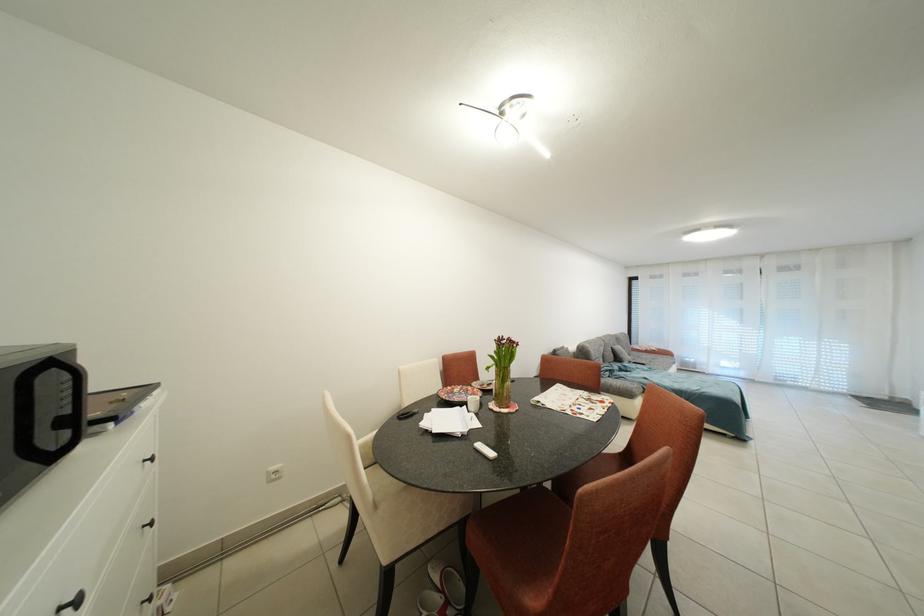
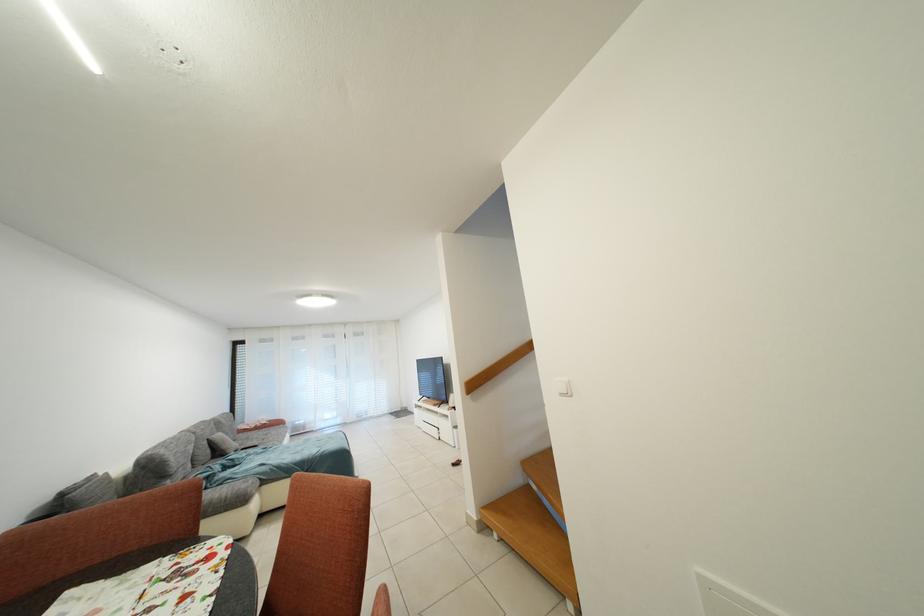
Find the pixel in the second image that matches (626,363) in the first image.

(226, 456)